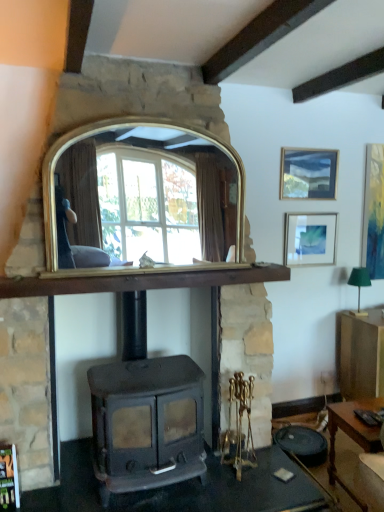
Question: Does matte gold picture frame at right, arranged as the 1th picture frame when viewed from the right, touch gold/glass mirror at center?

Choices:
 (A) no
 (B) yes

Answer: (A)

Question: Is matte gold picture frame at right, the third picture frame when ordered from left to right, further to the viewer compared to gold/glass mirror at center?

Choices:
 (A) yes
 (B) no

Answer: (A)

Question: Considering the relative sizes of matte gold picture frame at right, arranged as the 1th picture frame when viewed from the right, and gold/glass mirror at center in the image provided, is matte gold picture frame at right, arranged as the 1th picture frame when viewed from the right, thinner than gold/glass mirror at center?

Choices:
 (A) no
 (B) yes

Answer: (B)

Question: From the image's perspective, is matte gold picture frame at right, arranged as the 1th picture frame when viewed from the right, below gold/glass mirror at center?

Choices:
 (A) no
 (B) yes

Answer: (A)

Question: Is gold/glass mirror at center located within matte gold picture frame at right, the third picture frame when ordered from left to right?

Choices:
 (A) no
 (B) yes

Answer: (A)

Question: Considering the relative sizes of matte gold picture frame at right, arranged as the 1th picture frame when viewed from the right, and gold/glass mirror at center in the image provided, is matte gold picture frame at right, arranged as the 1th picture frame when viewed from the right, taller than gold/glass mirror at center?

Choices:
 (A) yes
 (B) no

Answer: (A)

Question: Is wooden mantel at center smaller than wooden desk at lower right?

Choices:
 (A) yes
 (B) no

Answer: (B)

Question: Is wooden desk at lower right a part of wooden mantel at center?

Choices:
 (A) yes
 (B) no

Answer: (B)

Question: Does wooden mantel at center touch wooden desk at lower right?

Choices:
 (A) no
 (B) yes

Answer: (A)

Question: Are wooden mantel at center and wooden desk at lower right located far from each other?

Choices:
 (A) yes
 (B) no

Answer: (A)

Question: Considering the relative sizes of wooden mantel at center and wooden desk at lower right in the image provided, is wooden mantel at center shorter than wooden desk at lower right?

Choices:
 (A) no
 (B) yes

Answer: (B)

Question: From a real-world perspective, is wooden mantel at center positioned over wooden desk at lower right based on gravity?

Choices:
 (A) yes
 (B) no

Answer: (A)

Question: Is the surface of matte black wood burning stove at center in direct contact with wooden mantel at center?

Choices:
 (A) yes
 (B) no

Answer: (B)